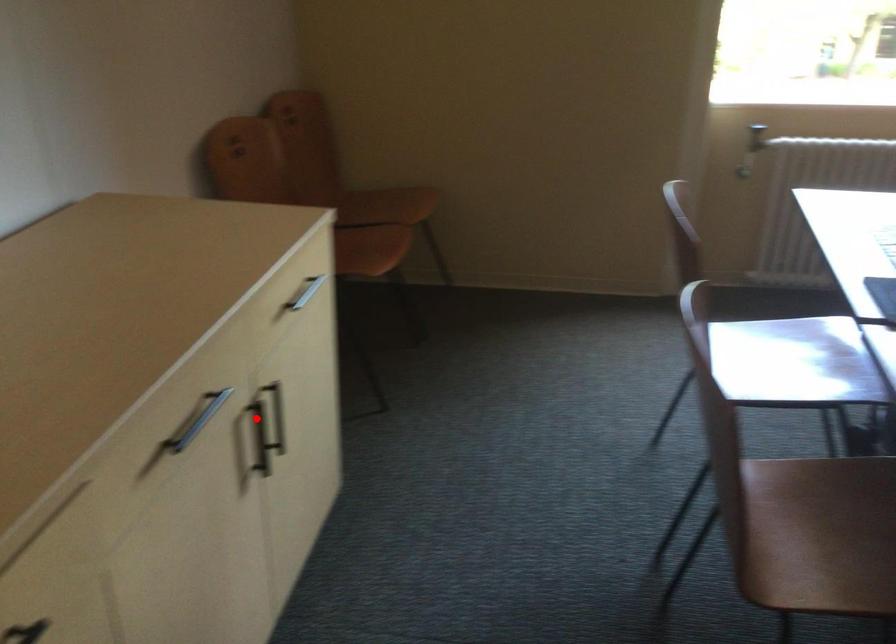
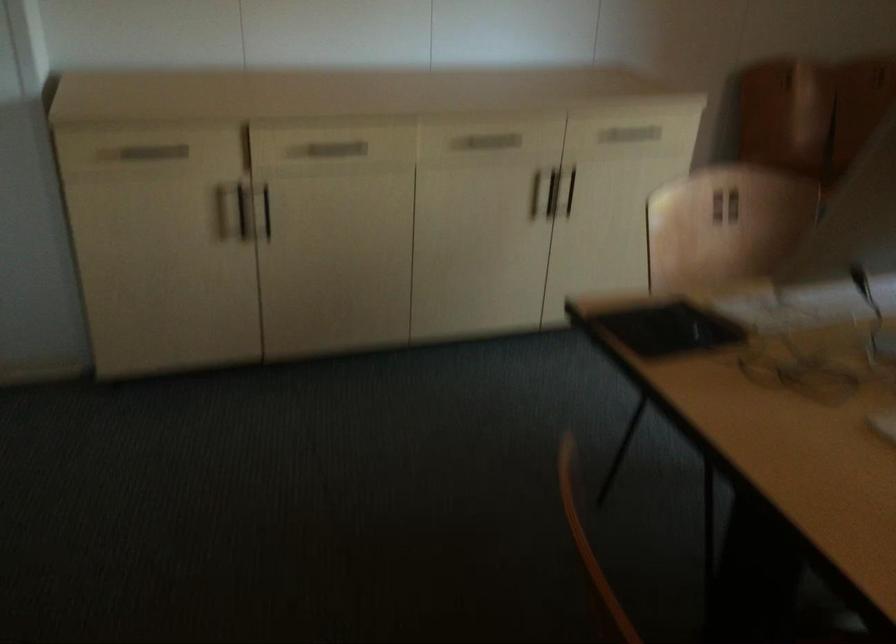
Question: I am providing you with two images of the same scene from different viewpoints. In image1, a red point is highlighted. Considering the same 3D point in image2, which of the following is correct?

Choices:
 (A) It is closer
 (B) It is farther

Answer: (B)